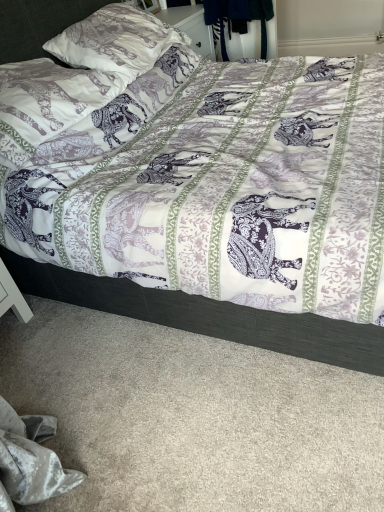
In order to face purple printed fabric bed at center, should I rotate leftwards or rightwards?

You should look right and rotate roughly 0.417 degrees.

What do you see at coordinates (46, 103) in the screenshot? I see `printed fabric pillow at upper left, which is the 2th pillow in top-to-bottom order` at bounding box center [46, 103].

The width and height of the screenshot is (384, 512). I want to click on purple printed fabric bed at center, so click(x=208, y=316).

Considering the sizes of objects purple printed fabric bed at center and printed fabric pillow at upper left, placed as the first pillow when sorted from bottom to top, in the image provided, who is bigger, purple printed fabric bed at center or printed fabric pillow at upper left, placed as the first pillow when sorted from bottom to top,?

With larger size is purple printed fabric bed at center.

From the image's perspective, which one is positioned higher, purple printed fabric bed at center or printed fabric pillow at upper left, which is the 2th pillow in top-to-bottom order?

From the image's view, purple printed fabric bed at center is above.

In terms of width, does purple printed fabric bed at center look wider or thinner when compared to printed fabric pillow at upper left, which is the 2th pillow in top-to-bottom order?

purple printed fabric bed at center is wider than printed fabric pillow at upper left, which is the 2th pillow in top-to-bottom order.

Which point is more distant from viewer, (155,49) or (22,50)?

The point (155,49) is farther from the camera.

From a real-world perspective, between matte white pillow at upper left, which is counted as the 2th pillow, starting from the bottom, and purple printed fabric bed at center, who is vertically lower?

purple printed fabric bed at center.

Which object is wider, matte white pillow at upper left, placed as the 1th pillow when sorted from top to bottom, or purple printed fabric bed at center?

With larger width is purple printed fabric bed at center.

Is matte white pillow at upper left, placed as the 1th pillow when sorted from top to bottom, taller than purple printed fabric bed at center?

In fact, matte white pillow at upper left, placed as the 1th pillow when sorted from top to bottom, may be shorter than purple printed fabric bed at center.

Is printed fabric pillow at upper left, which is the 2th pillow in top-to-bottom order, not near matte white pillow at upper left, placed as the 1th pillow when sorted from top to bottom?

That's not correct — printed fabric pillow at upper left, which is the 2th pillow in top-to-bottom order, is a little close to matte white pillow at upper left, placed as the 1th pillow when sorted from top to bottom.

Locate an element on the screen. pillow located behind the printed fabric pillow at upper left, placed as the first pillow when sorted from bottom to top is located at coordinates pyautogui.click(x=116, y=41).

Is printed fabric pillow at upper left, which is the 2th pillow in top-to-bottom order, oriented towards matte white pillow at upper left, which is counted as the 2th pillow, starting from the bottom?

No, printed fabric pillow at upper left, which is the 2th pillow in top-to-bottom order, is not oriented towards matte white pillow at upper left, which is counted as the 2th pillow, starting from the bottom.

Can you confirm if matte white pillow at upper left, placed as the 1th pillow when sorted from top to bottom, is shorter than printed fabric pillow at upper left, placed as the first pillow when sorted from bottom to top?

Incorrect, the height of matte white pillow at upper left, placed as the 1th pillow when sorted from top to bottom, does not fall short of that of printed fabric pillow at upper left, placed as the first pillow when sorted from bottom to top.

Based on the photo, would you consider matte white pillow at upper left, which is counted as the 2th pillow, starting from the bottom, to be distant from printed fabric pillow at upper left, placed as the first pillow when sorted from bottom to top?

No, matte white pillow at upper left, which is counted as the 2th pillow, starting from the bottom, is in close proximity to printed fabric pillow at upper left, placed as the first pillow when sorted from bottom to top.

Does matte white pillow at upper left, which is counted as the 2th pillow, starting from the bottom, have a smaller size compared to printed fabric pillow at upper left, placed as the first pillow when sorted from bottom to top?

No.

Between matte white pillow at upper left, which is counted as the 2th pillow, starting from the bottom, and printed fabric pillow at upper left, which is the 2th pillow in top-to-bottom order, which one appears on the right side from the viewer's perspective?

Positioned to the right is matte white pillow at upper left, which is counted as the 2th pillow, starting from the bottom.

Which of these two, printed fabric pillow at upper left, which is the 2th pillow in top-to-bottom order, or purple printed fabric bed at center, is smaller?

With smaller size is printed fabric pillow at upper left, which is the 2th pillow in top-to-bottom order.

Locate an element on the screen. This screenshot has height=512, width=384. bed on the right of printed fabric pillow at upper left, placed as the first pillow when sorted from bottom to top is located at coordinates (208, 316).

From the image's perspective, is printed fabric pillow at upper left, which is the 2th pillow in top-to-bottom order, above purple printed fabric bed at center?

No, from the image's perspective, printed fabric pillow at upper left, which is the 2th pillow in top-to-bottom order, is not over purple printed fabric bed at center.

Is printed fabric pillow at upper left, placed as the first pillow when sorted from bottom to top, at the left side of purple printed fabric bed at center?

Yes.

What's the angular difference between purple printed fabric bed at center and matte white pillow at upper left, placed as the 1th pillow when sorted from top to bottom,'s facing directions?

0.519 degrees separate the facing orientations of purple printed fabric bed at center and matte white pillow at upper left, placed as the 1th pillow when sorted from top to bottom.

Which object is closer to the camera, purple printed fabric bed at center or matte white pillow at upper left, placed as the 1th pillow when sorted from top to bottom?

purple printed fabric bed at center.

Consider the image. Is purple printed fabric bed at center next to matte white pillow at upper left, placed as the 1th pillow when sorted from top to bottom?

No, purple printed fabric bed at center is not touching matte white pillow at upper left, placed as the 1th pillow when sorted from top to bottom.

In terms of height, does purple printed fabric bed at center look taller or shorter compared to matte white pillow at upper left, placed as the 1th pillow when sorted from top to bottom?

In the image, purple printed fabric bed at center appears to be taller than matte white pillow at upper left, placed as the 1th pillow when sorted from top to bottom.

You are a GUI agent. You are given a task and a screenshot of the screen. Output one action in this format:
    pyautogui.click(x=<x>, y=<y>)
    Task: Click on the bed that is under the printed fabric pillow at upper left, placed as the first pillow when sorted from bottom to top (from a real-world perspective)
    
    Given the screenshot: What is the action you would take?
    pyautogui.click(x=208, y=316)

Find the location of a particular element. This screenshot has width=384, height=512. the 2nd pillow behind when counting from the purple printed fabric bed at center is located at coordinates (116, 41).

Looking at the image, which one is located closer to printed fabric pillow at upper left, placed as the first pillow when sorted from bottom to top, purple printed fabric bed at center or matte white pillow at upper left, placed as the 1th pillow when sorted from top to bottom?

matte white pillow at upper left, placed as the 1th pillow when sorted from top to bottom, is positioned closer to the anchor printed fabric pillow at upper left, placed as the first pillow when sorted from bottom to top.

Based on their spatial positions, is purple printed fabric bed at center or printed fabric pillow at upper left, which is the 2th pillow in top-to-bottom order, further from matte white pillow at upper left, placed as the 1th pillow when sorted from top to bottom?

Among the two, purple printed fabric bed at center is located further to matte white pillow at upper left, placed as the 1th pillow when sorted from top to bottom.

Which object lies nearer to the anchor point purple printed fabric bed at center, printed fabric pillow at upper left, which is the 2th pillow in top-to-bottom order, or matte white pillow at upper left, which is counted as the 2th pillow, starting from the bottom?

The object closer to purple printed fabric bed at center is printed fabric pillow at upper left, which is the 2th pillow in top-to-bottom order.

Looking at the image, which one is located further to printed fabric pillow at upper left, which is the 2th pillow in top-to-bottom order, matte white pillow at upper left, placed as the 1th pillow when sorted from top to bottom, or purple printed fabric bed at center?

Among the two, purple printed fabric bed at center is located further to printed fabric pillow at upper left, which is the 2th pillow in top-to-bottom order.

Considering their positions, is printed fabric pillow at upper left, which is the 2th pillow in top-to-bottom order, positioned closer to matte white pillow at upper left, placed as the 1th pillow when sorted from top to bottom, than purple printed fabric bed at center?

printed fabric pillow at upper left, which is the 2th pillow in top-to-bottom order, is positioned closer to the anchor matte white pillow at upper left, placed as the 1th pillow when sorted from top to bottom.

Which object lies nearer to the anchor point purple printed fabric bed at center, matte white pillow at upper left, placed as the 1th pillow when sorted from top to bottom, or printed fabric pillow at upper left, placed as the first pillow when sorted from bottom to top?

printed fabric pillow at upper left, placed as the first pillow when sorted from bottom to top, is positioned closer to the anchor purple printed fabric bed at center.

I want to click on pillow between purple printed fabric bed at center and matte white pillow at upper left, which is counted as the 2th pillow, starting from the bottom, along the z-axis, so click(x=46, y=103).